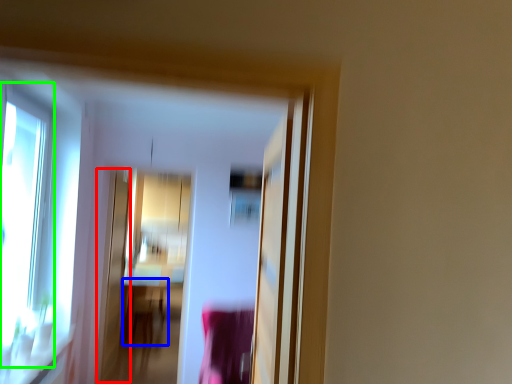
Question: Which object is positioned closest to screen door (highlighted by a red box)? Select from table (highlighted by a blue box) and window (highlighted by a green box).

Choices:
 (A) table
 (B) window

Answer: (B)